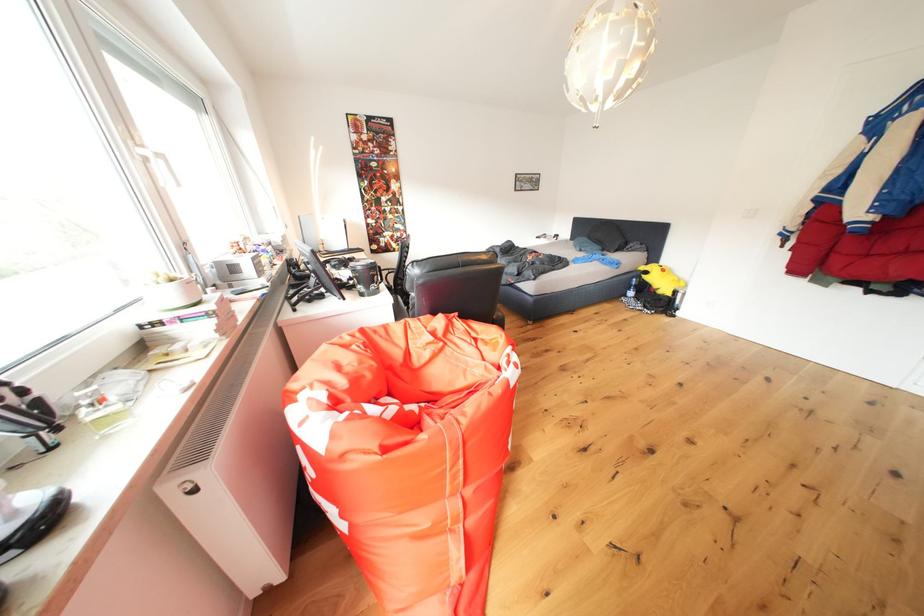
What do you see at coordinates (151, 168) in the screenshot?
I see `a white window handle` at bounding box center [151, 168].